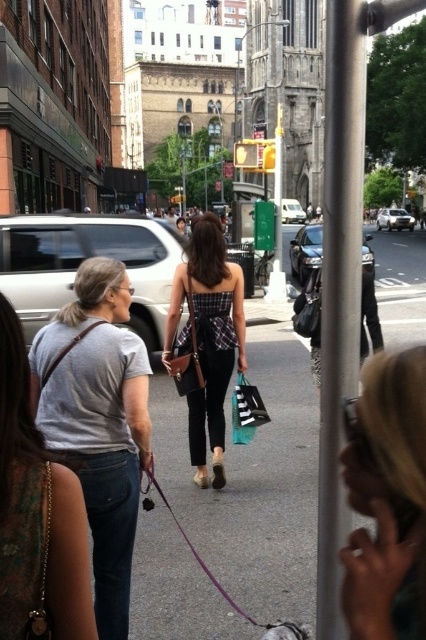
Can you confirm if blonde hair at upper right is thinner than denim jeans at center?

Yes, blonde hair at upper right is thinner than denim jeans at center.

Between blonde hair at upper right and denim jeans at center, which one appears on the right side from the viewer's perspective?

From the viewer's perspective, blonde hair at upper right appears more on the right side.

Is point (359, 442) positioned before point (63, 592)?

Yes, point (359, 442) is closer to viewer.

Locate an element on the screen. Image resolution: width=426 pixels, height=640 pixels. blonde hair at upper right is located at coordinates (386, 499).

Measure the distance from metallic gray pole at center to denim jeans at center.

metallic gray pole at center and denim jeans at center are 15.57 meters apart.

Can you confirm if metallic gray pole at center is wider than denim jeans at center?

No.

Who is more forward, (327, 168) or (14, 468)?

Point (14, 468) is in front.

At what (x,y) coordinates should I click in order to perform the action: click on metallic gray pole at center. Please return your answer as a coordinate pair (x, y). Looking at the image, I should click on (339, 284).

Between plaid fabric dress at center and black matte shopping bag at center, which one is positioned higher?

Positioned higher is plaid fabric dress at center.

Who is more distant from viewer, (175, 285) or (256, 412)?

The point (175, 285) is behind.

This screenshot has width=426, height=640. What are the coordinates of `plaid fabric dress at center` in the screenshot? It's located at (207, 339).